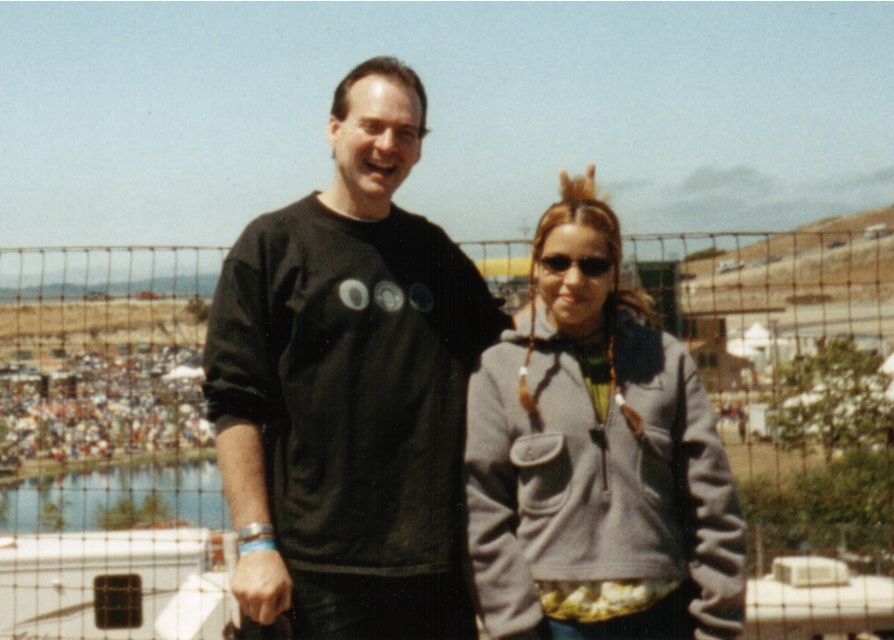
This screenshot has height=640, width=894. What do you see at coordinates (349, 388) in the screenshot?
I see `black matte shirt at center` at bounding box center [349, 388].

Which is below, black matte shirt at center or gray fleece jacket at center?

Positioned lower is black matte shirt at center.

Is point (352, 209) less distant than point (534, 570)?

No, (352, 209) is further to viewer.

The height and width of the screenshot is (640, 894). What are the coordinates of `black matte shirt at center` in the screenshot? It's located at tap(349, 388).

Who is positioned more to the right, metal mesh fence at center or black plastic sunglasses at upper center?

metal mesh fence at center is more to the right.

Is metal mesh fence at center positioned before black plastic sunglasses at upper center?

No, it is not.

Which is in front, point (167, 321) or point (561, 259)?

Point (561, 259)

The image size is (894, 640). I want to click on metal mesh fence at center, so click(x=106, y=444).

Who is more forward, (x=86, y=278) or (x=739, y=625)?

Point (x=739, y=625) is in front.

Which is behind, point (100, 611) or point (699, 532)?

Point (100, 611)

Locate an element on the screen. Image resolution: width=894 pixels, height=640 pixels. metal mesh fence at center is located at coordinates (106, 444).